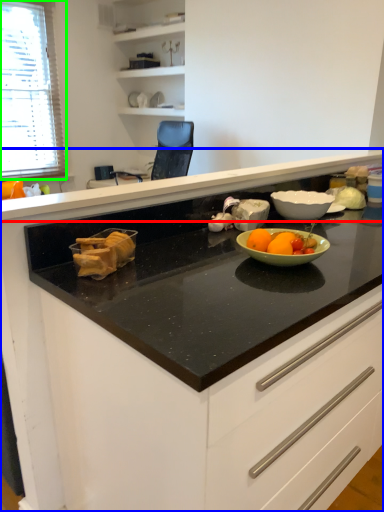
Question: Considering the real-world distances, which object is farthest from countertop (highlighted by a red box)? cabinetry (highlighted by a blue box) or window (highlighted by a green box)?

Choices:
 (A) cabinetry
 (B) window

Answer: (B)